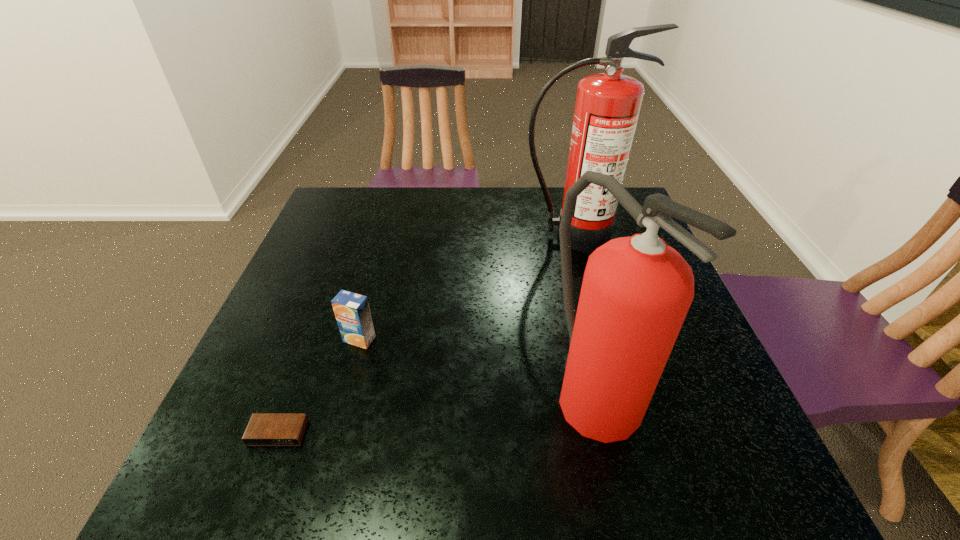
Where is `object present at the far edge`? object present at the far edge is located at coordinates (607, 107).

I want to click on object that is at the near edge, so click(636, 292).

Image resolution: width=960 pixels, height=540 pixels. Identify the location of object present at the left edge. (264, 429).

Identify the location of object present at the right edge. (607, 107).

I want to click on object present at the far right corner, so click(607, 107).

Identify the location of vacant space at the far edge of the desktop. The width and height of the screenshot is (960, 540). (444, 211).

In order to click on vacant area at the near edge in this screenshot , I will do `click(411, 464)`.

You are a GUI agent. You are given a task and a screenshot of the screen. Output one action in this format:
    pyautogui.click(x=<x>, y=<y>)
    Task: Click on the vacant point at the left edge
    
    Given the screenshot: What is the action you would take?
    pyautogui.click(x=319, y=268)

This screenshot has width=960, height=540. Identify the location of vacant space at the far left corner of the desktop. (349, 225).

The width and height of the screenshot is (960, 540). What are the coordinates of `blank region between the farthest object and the second shortest object` in the screenshot? It's located at 466,288.